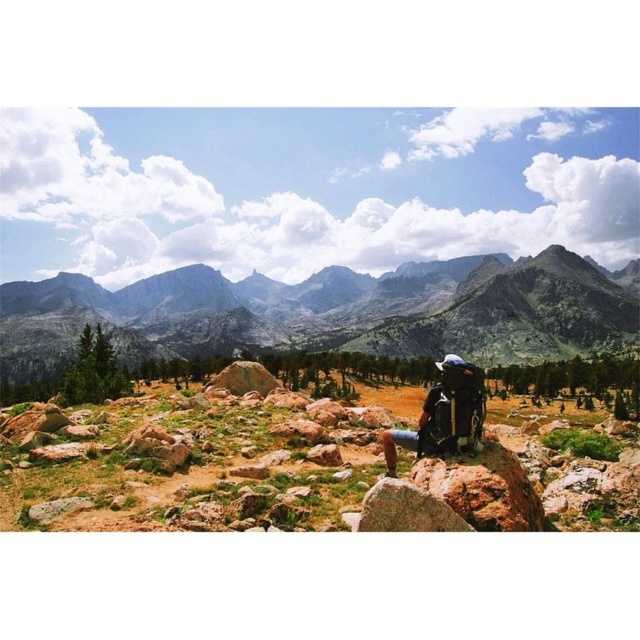
Question: In this image, where is brown rocky terrain at center located relative to matte black backpack at center?

Choices:
 (A) right
 (B) left

Answer: (B)

Question: Does gray rock formation at center appear on the right side of matte black backpack at center?

Choices:
 (A) no
 (B) yes

Answer: (A)

Question: Which point appears farthest from the camera in this image?

Choices:
 (A) (522, 292)
 (B) (243, 433)
 (C) (394, 460)

Answer: (A)

Question: Which point is farther to the camera?

Choices:
 (A) [624, 330]
 (B) [611, 504]
 (C) [483, 394]

Answer: (A)

Question: Estimate the real-world distances between objects in this image. Which object is closer to the matte black backpack at center?

Choices:
 (A) brown rocky terrain at center
 (B) gray rock formation at center

Answer: (A)

Question: Is brown rocky terrain at center positioned in front of matte black backpack at center?

Choices:
 (A) no
 (B) yes

Answer: (B)